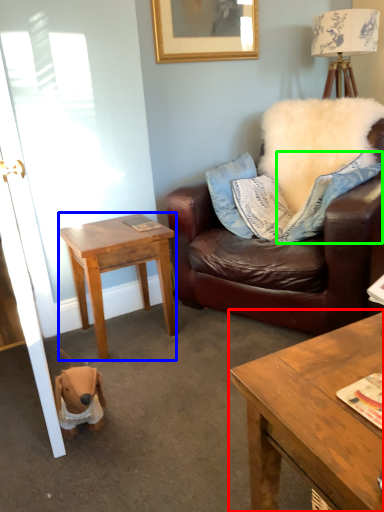
Question: Which is nearer to the coffee table (highlighted by a red box)? desk (highlighted by a blue box) or pillow (highlighted by a green box).

Choices:
 (A) desk
 (B) pillow

Answer: (B)